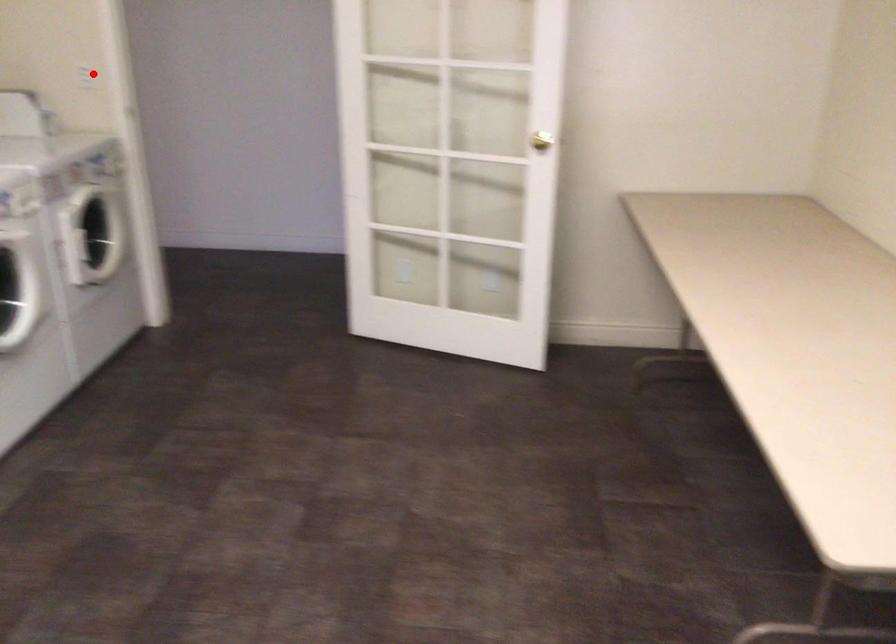
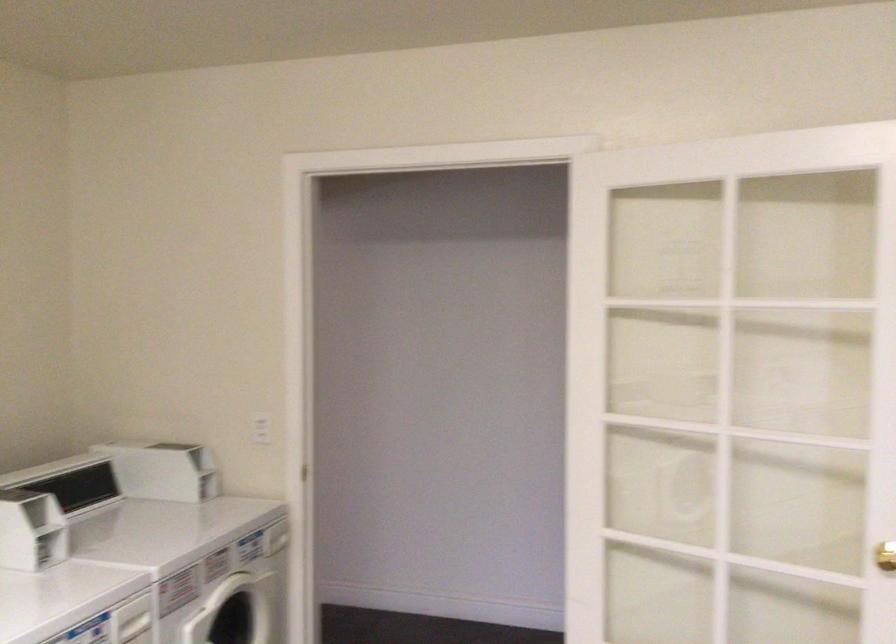
In the second image, find the point that corresponds to the highlighted location in the first image.

(261, 428)